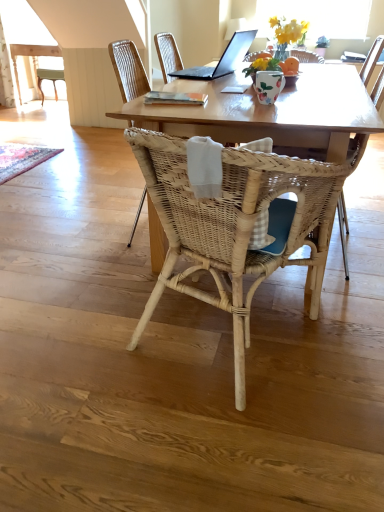
Question: In which direction should I rotate to look at woven wood chair at center, which is counted as the second chair, starting from the front?

Choices:
 (A) left
 (B) right

Answer: (A)

Question: From the image's perspective, is rustic woven mat at lower left under woven rattan chair at center?

Choices:
 (A) yes
 (B) no

Answer: (B)

Question: Is rustic woven mat at lower left positioned beyond the bounds of woven rattan chair at center?

Choices:
 (A) no
 (B) yes

Answer: (B)

Question: Considering the relative sizes of rustic woven mat at lower left and woven rattan chair at center in the image provided, is rustic woven mat at lower left taller than woven rattan chair at center?

Choices:
 (A) no
 (B) yes

Answer: (A)

Question: Can you confirm if rustic woven mat at lower left is shorter than woven rattan chair at center?

Choices:
 (A) no
 (B) yes

Answer: (B)

Question: From a real-world perspective, is rustic woven mat at lower left physically below woven rattan chair at center?

Choices:
 (A) no
 (B) yes

Answer: (B)

Question: Is the position of rustic woven mat at lower left more distant than that of woven rattan chair at center?

Choices:
 (A) yes
 (B) no

Answer: (A)

Question: Is woven wood chair at center, positioned as the first chair in front-to-back order, closer to the viewer compared to floral ceramic vase at upper center?

Choices:
 (A) yes
 (B) no

Answer: (A)

Question: Is woven wood chair at center, positioned as the first chair in front-to-back order, at the left side of floral ceramic vase at upper center?

Choices:
 (A) yes
 (B) no

Answer: (A)

Question: Could you tell me if woven wood chair at center, positioned as the first chair in front-to-back order, is facing floral ceramic vase at upper center?

Choices:
 (A) no
 (B) yes

Answer: (B)

Question: From a real-world perspective, does woven wood chair at center, positioned as the first chair in front-to-back order, stand above floral ceramic vase at upper center?

Choices:
 (A) yes
 (B) no

Answer: (B)

Question: Is woven wood chair at center, the 2th chair positioned from the back, not inside floral ceramic vase at upper center?

Choices:
 (A) yes
 (B) no

Answer: (A)

Question: From a real-world perspective, is woven wood chair at center, the 2th chair positioned from the back, positioned under floral ceramic vase at upper center based on gravity?

Choices:
 (A) yes
 (B) no

Answer: (A)

Question: Is woven rattan chair at center completely or partially outside of rustic woven mat at lower left?

Choices:
 (A) no
 (B) yes

Answer: (B)